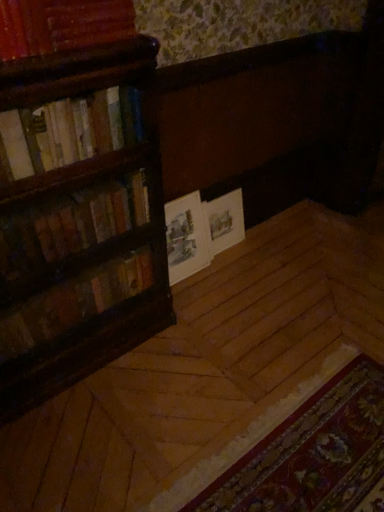
What do you see at coordinates (73, 302) in the screenshot? The width and height of the screenshot is (384, 512). I see `wooden bookshelf at left, placed as the 4th book when sorted from top to bottom` at bounding box center [73, 302].

Measure the distance between point (212, 223) and camera.

Point (212, 223) is 7.22 feet from camera.

The image size is (384, 512). What do you see at coordinates (186, 237) in the screenshot?
I see `white paper at center` at bounding box center [186, 237].

In order to face white paper at center, should I rotate leftwards or rightwards?

Rotate left and turn 1.036 degrees.

What do you see at coordinates (312, 453) in the screenshot? The height and width of the screenshot is (512, 384). I see `carpeted mat at lower right` at bounding box center [312, 453].

Find the location of a particular element. The image size is (384, 512). hardcover books at left, arranged as the third book when ordered from the bottom is located at coordinates (69, 130).

Between white paper book at center and white paper at center, which one appears on the right side from the viewer's perspective?

white paper book at center is more to the right.

Locate an element on the screen. Image resolution: width=384 pixels, height=512 pixels. book cover above the white paper at center (from the image's perspective) is located at coordinates (223, 222).

Is point (222, 223) farther from viewer compared to point (171, 269)?

Yes.

Is white paper book at center outside of white paper at center?

white paper book at center is positioned outside white paper at center.

Which object is positioned more to the right, hardcover books at left, arranged as the third book when ordered from the bottom, or carpeted mat at lower right?

carpeted mat at lower right.

In the image, is hardcover books at left, arranged as the 2th book when viewed from the top, positioned in front of or behind carpeted mat at lower right?

hardcover books at left, arranged as the 2th book when viewed from the top, is behind carpeted mat at lower right.

Is hardcover books at left, arranged as the third book when ordered from the bottom, inside the boundaries of carpeted mat at lower right, or outside?

hardcover books at left, arranged as the third book when ordered from the bottom, lies outside carpeted mat at lower right.

Considering the relative sizes of wooden bookshelf at left, placed as the 4th book when sorted from top to bottom, and white paper book at center in the image provided, is wooden bookshelf at left, placed as the 4th book when sorted from top to bottom, taller than white paper book at center?

No, wooden bookshelf at left, placed as the 4th book when sorted from top to bottom, is not taller than white paper book at center.

Is wooden bookshelf at left, placed as the first book when sorted from bottom to top, next to white paper book at center and touching it?

wooden bookshelf at left, placed as the first book when sorted from bottom to top, and white paper book at center are clearly separated.

Looking at this image, based on their positions, is wooden bookshelf at left, placed as the 4th book when sorted from top to bottom, located to the left or right of white paper book at center?

Based on their positions, wooden bookshelf at left, placed as the 4th book when sorted from top to bottom, is located to the left of white paper book at center.

Considering the relative positions of carpeted mat at lower right and wooden bookshelf at left, placed as the 4th book when sorted from top to bottom, in the image provided, is carpeted mat at lower right to the left or to the right of wooden bookshelf at left, placed as the 4th book when sorted from top to bottom,?

carpeted mat at lower right is to the right of wooden bookshelf at left, placed as the 4th book when sorted from top to bottom.

In terms of size, does carpeted mat at lower right appear bigger or smaller than wooden bookshelf at left, placed as the first book when sorted from bottom to top?

carpeted mat at lower right is bigger than wooden bookshelf at left, placed as the first book when sorted from bottom to top.

Locate an element on the screen. The height and width of the screenshot is (512, 384). mat below the wooden bookshelf at left, placed as the first book when sorted from bottom to top (from a real-world perspective) is located at coordinates point(312,453).

From a real-world perspective, is carpeted mat at lower right over wooden bookshelf at left, placed as the 4th book when sorted from top to bottom?

No, from a real-world perspective, carpeted mat at lower right is not over wooden bookshelf at left, placed as the 4th book when sorted from top to bottom

Can you tell me how much hardcover books at left, arranged as the third book when ordered from the bottom, and white paper book at center differ in facing direction?

hardcover books at left, arranged as the third book when ordered from the bottom, and white paper book at center are facing 0.32 degrees away from each other.

Could you tell me if hardcover books at left, arranged as the third book when ordered from the bottom, is facing white paper book at center?

No.

Is hardcover books at left, arranged as the third book when ordered from the bottom, bigger or smaller than white paper book at center?

hardcover books at left, arranged as the third book when ordered from the bottom, is bigger than white paper book at center.

Is there a large distance between wooden book at upper left, which is counted as the fourth book, starting from the bottom, and white paper at center?

Actually, wooden book at upper left, which is counted as the fourth book, starting from the bottom, and white paper at center are a little close together.

Is wooden book at upper left, placed as the 1th book when sorted from top to bottom, inside or outside of white paper at center?

wooden book at upper left, placed as the 1th book when sorted from top to bottom, is spatially situated outside white paper at center.

Considering the relative sizes of hardcover books at left, arranged as the 2th book when viewed from the top, and hardcover books at left, which is the second book in bottom-to-top order, in the image provided, is hardcover books at left, arranged as the 2th book when viewed from the top, bigger than hardcover books at left, which is the second book in bottom-to-top order,?

Incorrect, hardcover books at left, arranged as the 2th book when viewed from the top, is not larger than hardcover books at left, which is the second book in bottom-to-top order.

From a real-world perspective, is hardcover books at left, arranged as the third book when ordered from the bottom, on top of hardcover books at left, which is the second book in bottom-to-top order?

Yes, from a real-world perspective, hardcover books at left, arranged as the third book when ordered from the bottom, is over hardcover books at left, which is the second book in bottom-to-top order

Is hardcover books at left, arranged as the 2th book when viewed from the top, next to hardcover books at left, placed as the 3th book when sorted from top to bottom, and touching it?

hardcover books at left, arranged as the 2th book when viewed from the top, is not next to hardcover books at left, placed as the 3th book when sorted from top to bottom, and they're not touching.

The image size is (384, 512). I want to click on paperback book in front of the white paper book at center, so click(186, 237).

From a real-world perspective, starting from the carpeted mat at lower right, which book is the 3rd one vertically above it? Please provide its 2D coordinates.

[(69, 130)]

Considering their positions, is white paper at center positioned closer to wooden bookshelf at left, placed as the first book when sorted from bottom to top, than hardcover books at left, arranged as the third book when ordered from the bottom?

white paper at center lies closer to wooden bookshelf at left, placed as the first book when sorted from bottom to top, than the other object.

From the image, which object appears to be nearer to wooden book at upper left, which is counted as the fourth book, starting from the bottom, white paper book at center or white paper at center?

The object closer to wooden book at upper left, which is counted as the fourth book, starting from the bottom, is white paper at center.

Considering their positions, is carpeted mat at lower right positioned further to wooden book at upper left, which is counted as the fourth book, starting from the bottom, than wooden bookshelf at left, placed as the first book when sorted from bottom to top?

carpeted mat at lower right is positioned further to the anchor wooden book at upper left, which is counted as the fourth book, starting from the bottom.

From the image, which object appears to be nearer to wooden book at upper left, which is counted as the fourth book, starting from the bottom, white paper book at center or wooden bookshelf at left, placed as the first book when sorted from bottom to top?

wooden bookshelf at left, placed as the first book when sorted from bottom to top, is positioned closer to the anchor wooden book at upper left, which is counted as the fourth book, starting from the bottom.

When comparing their distances from carpeted mat at lower right, does hardcover books at left, placed as the 3th book when sorted from top to bottom, or wooden book at upper left, placed as the 1th book when sorted from top to bottom, seem closer?

hardcover books at left, placed as the 3th book when sorted from top to bottom, is closer to carpeted mat at lower right.

Based on their spatial positions, is wooden bookshelf at left, placed as the first book when sorted from bottom to top, or wooden book at upper left, placed as the 1th book when sorted from top to bottom, further from hardcover books at left, placed as the 3th book when sorted from top to bottom?

wooden book at upper left, placed as the 1th book when sorted from top to bottom, is further to hardcover books at left, placed as the 3th book when sorted from top to bottom.

When comparing their distances from carpeted mat at lower right, does hardcover books at left, arranged as the 2th book when viewed from the top, or white paper book at center seem closer?

white paper book at center is closer to carpeted mat at lower right.

From the image, which object appears to be nearer to wooden book at upper left, placed as the 1th book when sorted from top to bottom, white paper book at center or hardcover books at left, which is the second book in bottom-to-top order?

The object closer to wooden book at upper left, placed as the 1th book when sorted from top to bottom, is hardcover books at left, which is the second book in bottom-to-top order.

Find the location of a particular element. This screenshot has height=512, width=384. book cover between wooden book at upper left, which is counted as the fourth book, starting from the bottom, and carpeted mat at lower right in the up-down direction is located at coordinates (223, 222).

I want to click on paperback book that lies between hardcover books at left, arranged as the 2th book when viewed from the top, and carpeted mat at lower right from top to bottom, so click(x=186, y=237).

You are a GUI agent. You are given a task and a screenshot of the screen. Output one action in this format:
    pyautogui.click(x=<x>, y=<y>)
    Task: Click on the paperback book located between wooden book at upper left, placed as the 1th book when sorted from top to bottom, and white paper book at center in the depth direction
    
    Given the screenshot: What is the action you would take?
    pyautogui.click(x=186, y=237)

Where is `paperback book between wooden bookshelf at left, placed as the first book when sorted from bottom to top, and white paper book at center from front to back`? paperback book between wooden bookshelf at left, placed as the first book when sorted from bottom to top, and white paper book at center from front to back is located at coordinates tap(186, 237).